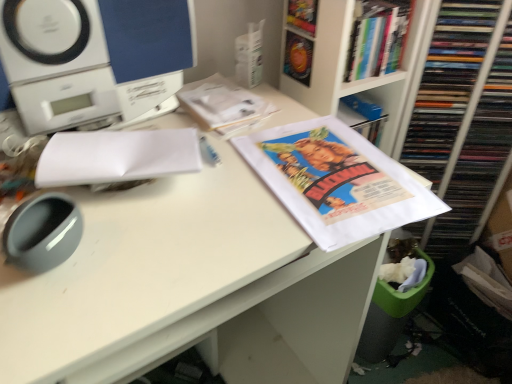
Locate an element on the screen. This screenshot has height=384, width=512. free space to the right of white paper at left is located at coordinates pyautogui.click(x=233, y=193).